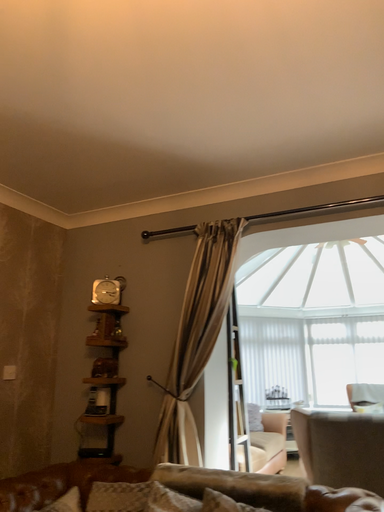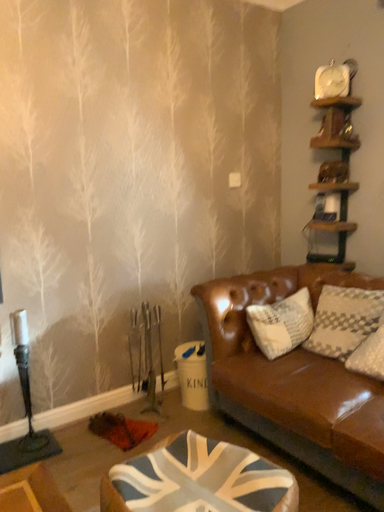
Question: How did the camera likely rotate when shooting the video?

Choices:
 (A) rotated downward
 (B) rotated upward

Answer: (A)